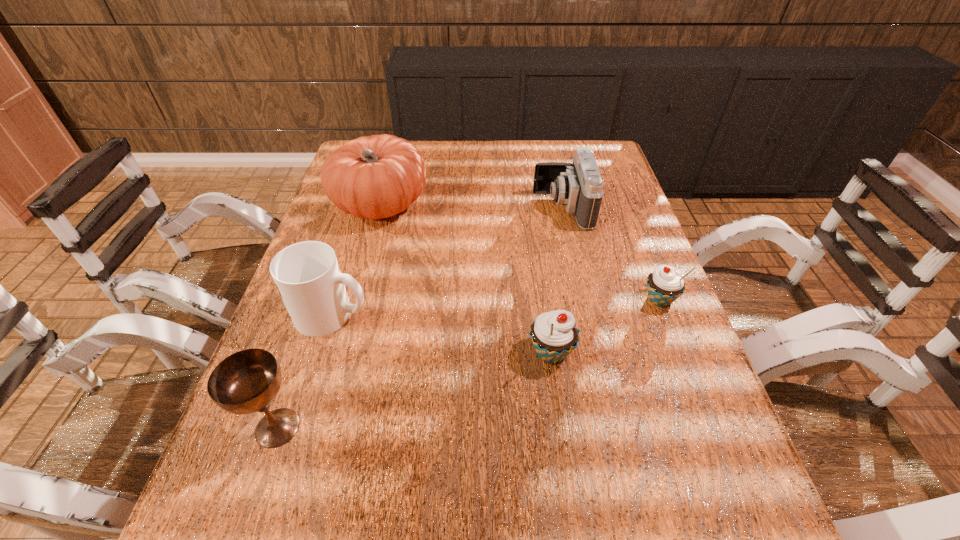
Given the evenly spaced cupcakes in the image, where should an extra cupcake be added on the left to preserve the spacing? Please point to a vacant space. Please provide its 2D coordinates. Your answer should be formatted as a tuple, i.e. [(x, y)], where the tuple contains the x and y coordinates of a point satisfying the conditions above.

[(416, 418)]